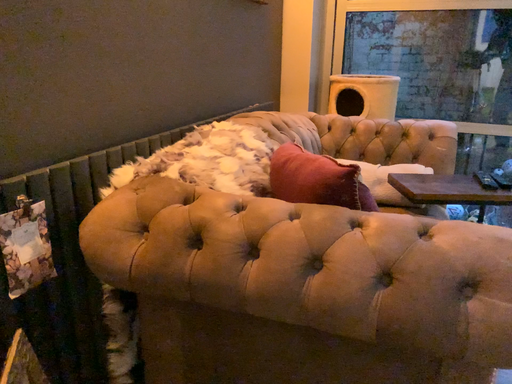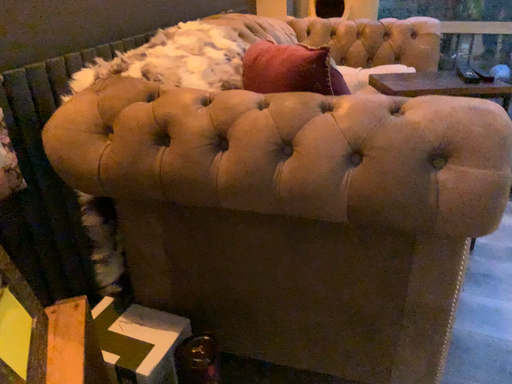
Question: Which way did the camera rotate in the video?

Choices:
 (A) rotated downward
 (B) rotated upward

Answer: (A)